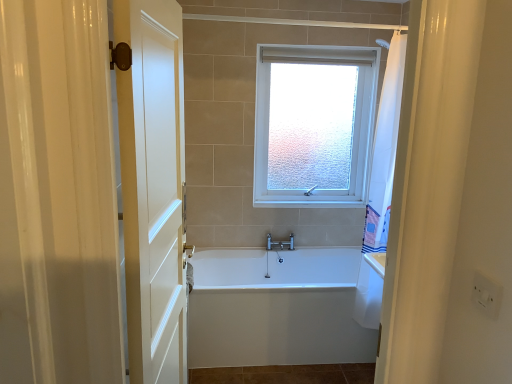
Question: Could you tell me if white glossy bathtub at center is turned towards frosted glass window at upper center?

Choices:
 (A) no
 (B) yes

Answer: (A)

Question: From a real-world perspective, is white glossy bathtub at center positioned under frosted glass window at upper center based on gravity?

Choices:
 (A) no
 (B) yes

Answer: (B)

Question: Are white glossy bathtub at center and frosted glass window at upper center making contact?

Choices:
 (A) yes
 (B) no

Answer: (B)

Question: Does white glossy bathtub at center have a greater width compared to frosted glass window at upper center?

Choices:
 (A) yes
 (B) no

Answer: (A)

Question: Is white glossy bathtub at center not within frosted glass window at upper center?

Choices:
 (A) yes
 (B) no

Answer: (A)

Question: Is white glossy bathtub at center thinner than frosted glass window at upper center?

Choices:
 (A) yes
 (B) no

Answer: (B)

Question: Does white wooden door at left have a smaller size compared to white glossy bathtub at center?

Choices:
 (A) no
 (B) yes

Answer: (B)

Question: Is white wooden door at left wider than white glossy bathtub at center?

Choices:
 (A) yes
 (B) no

Answer: (B)

Question: From a real-world perspective, is white wooden door at left under white glossy bathtub at center?

Choices:
 (A) yes
 (B) no

Answer: (B)

Question: Does white wooden door at left have a greater height compared to white glossy bathtub at center?

Choices:
 (A) no
 (B) yes

Answer: (B)

Question: Is white wooden door at left turned away from white glossy bathtub at center?

Choices:
 (A) yes
 (B) no

Answer: (B)

Question: Can white glossy bathtub at center be found inside white wooden door at left?

Choices:
 (A) no
 (B) yes

Answer: (A)

Question: Are white wooden door at left and frosted glass window at upper center far apart?

Choices:
 (A) yes
 (B) no

Answer: (A)